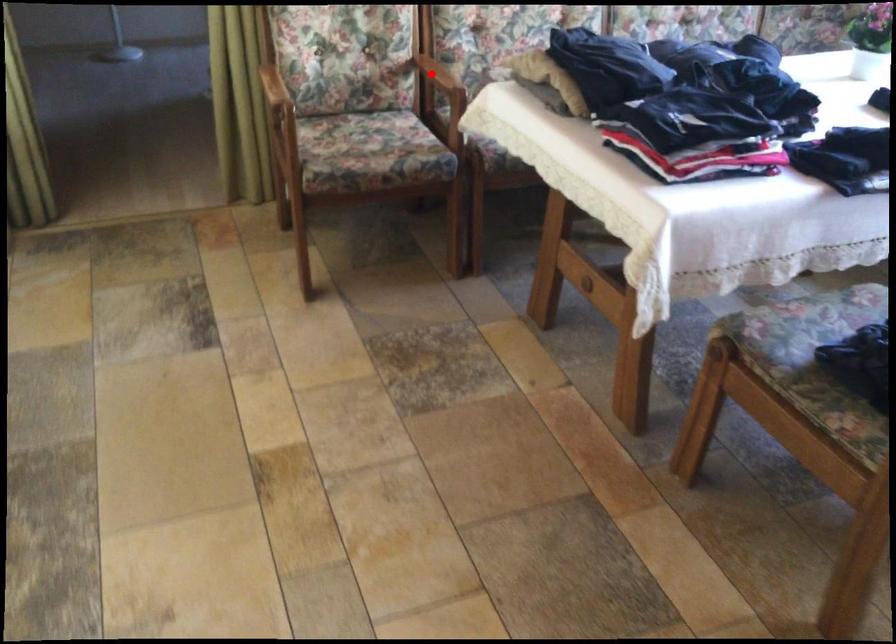
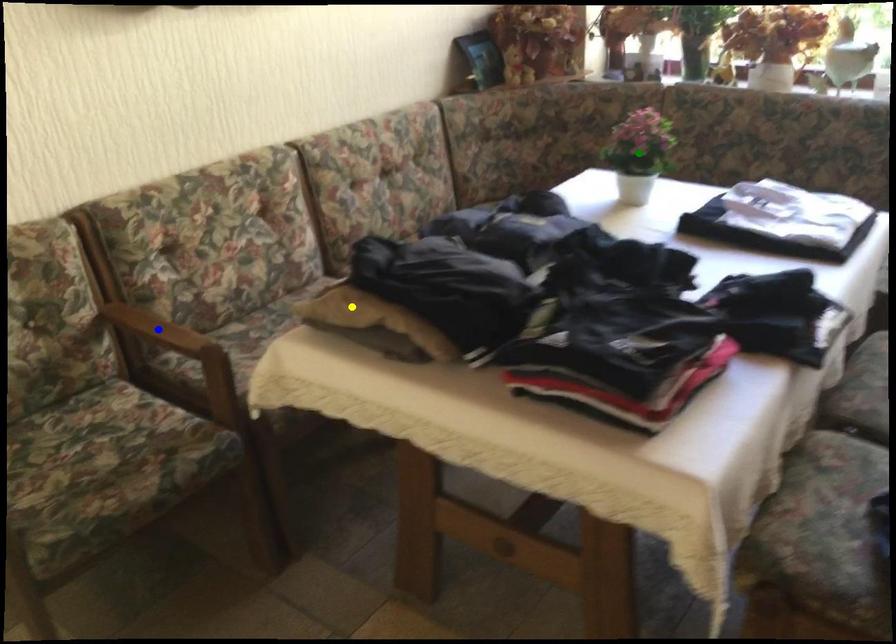
Question: I am providing you with two images of the same scene from different viewpoints. A red point is marked on the first image. You are given multiple points on the second image. In image 2, which mark is for the same physical point as the one in image 1?

Choices:
 (A) green point
 (B) blue point
 (C) yellow point

Answer: (B)